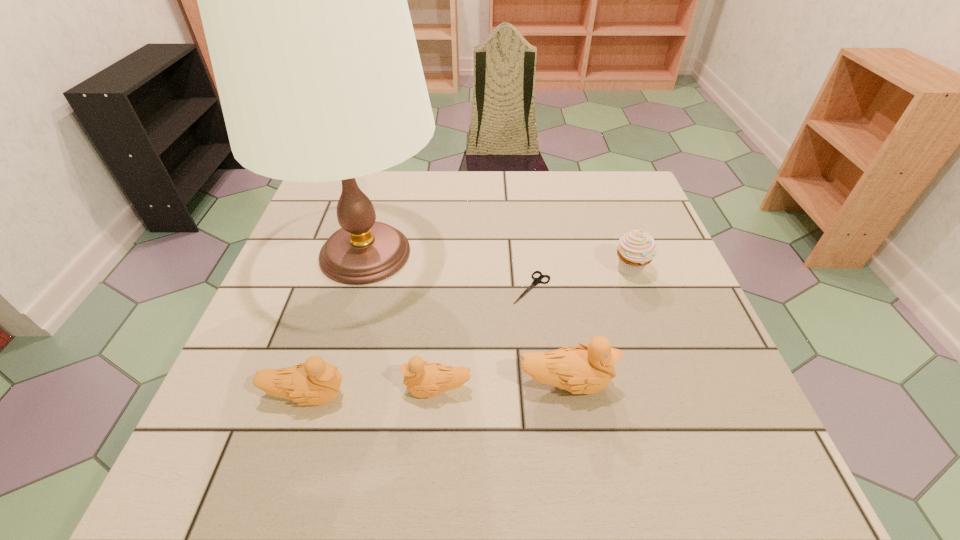
Select which object is the fifth closest to the shortest object. Please provide its 2D coordinates. Your answer should be formatted as a tuple, i.e. [(x, y)], where the tuple contains the x and y coordinates of a point satisfying the conditions above.

[(314, 382)]

Select which duckling is the closest to the leftmost duckling. Please provide its 2D coordinates. Your answer should be formatted as a tuple, i.e. [(x, y)], where the tuple contains the x and y coordinates of a point satisfying the conditions above.

[(422, 379)]

Point out which duckling is positioned as the nearest to the shortest duckling. Please provide its 2D coordinates. Your answer should be formatted as a tuple, i.e. [(x, y)], where the tuple contains the x and y coordinates of a point satisfying the conditions above.

[(588, 369)]

Where is `vacant space that satisfies the following two spatial constraints: 1. on the front side of the lamp; 2. on the right side of the shears`? Image resolution: width=960 pixels, height=540 pixels. vacant space that satisfies the following two spatial constraints: 1. on the front side of the lamp; 2. on the right side of the shears is located at coordinates (356, 288).

Locate an element on the screen. free spot that satisfies the following two spatial constraints: 1. on the front side of the lamp; 2. on the right side of the shortest object is located at coordinates (356, 288).

Find the location of a particular element. The width and height of the screenshot is (960, 540). blank space that satisfies the following two spatial constraints: 1. on the front side of the rightmost object; 2. on the face of the second duckling from left to right is located at coordinates (673, 389).